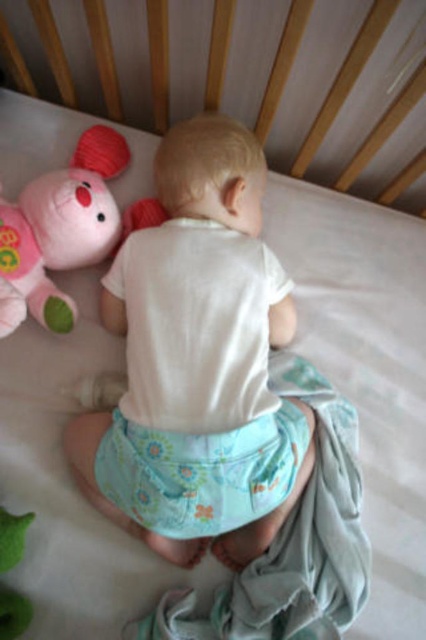
Question: Where is white cotton baby at center located in relation to floral fabric diaper at center in the image?

Choices:
 (A) right
 (B) left

Answer: (B)

Question: Does floral fabric diaper at center appear under green fabric toy at lower left?

Choices:
 (A) yes
 (B) no

Answer: (B)

Question: Which point is closer to the camera?

Choices:
 (A) green fabric toy at lower left
 (B) white cotton baby at center

Answer: (B)

Question: From the image, what is the correct spatial relationship of white cotton baby at center in relation to floral fabric diaper at center?

Choices:
 (A) left
 (B) right

Answer: (A)

Question: Which of the following is the farthest from the observer?

Choices:
 (A) green fabric toy at lower left
 (B) floral fabric diaper at center

Answer: (A)

Question: Among these points, which one is farthest from the camera?

Choices:
 (A) (23, 600)
 (B) (69, 236)
 (C) (247, 486)
 (D) (192, 272)

Answer: (B)